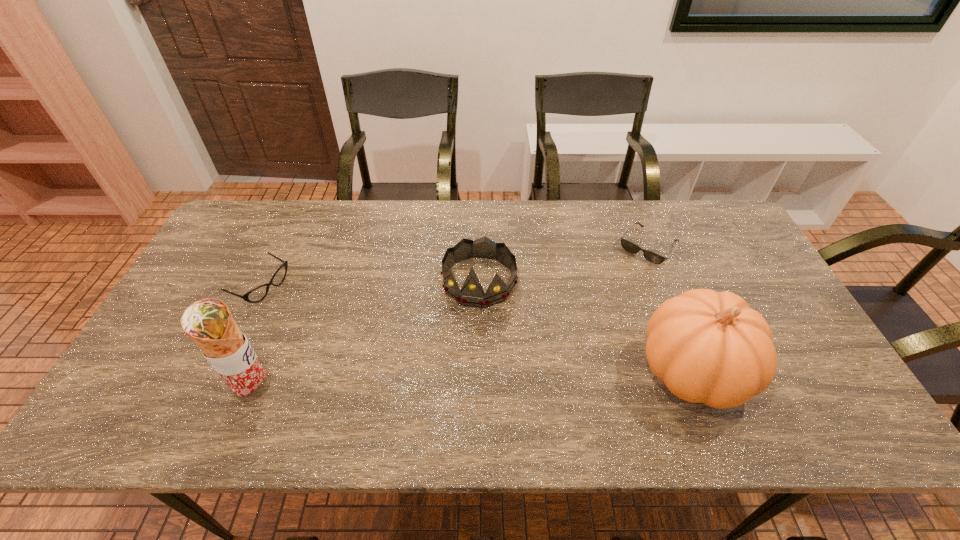
Image resolution: width=960 pixels, height=540 pixels. What are the coordinates of `vacant space on the desktop that is between the burrito and the pumpkin and is positioned at the front of the tiara with jewels` in the screenshot? It's located at (456, 380).

This screenshot has height=540, width=960. I want to click on vacant space on the desktop that is between the burrito and the pumpkin and is positioned on the front-facing side of the sunglasses, so (x=540, y=376).

At what (x,y) coordinates should I click in order to perform the action: click on vacant spot on the desktop that is between the burrito and the pumpkin and is positioned on the front-facing side of the spectacles. Please return your answer as a coordinate pair (x, y). This screenshot has width=960, height=540. Looking at the image, I should click on (454, 380).